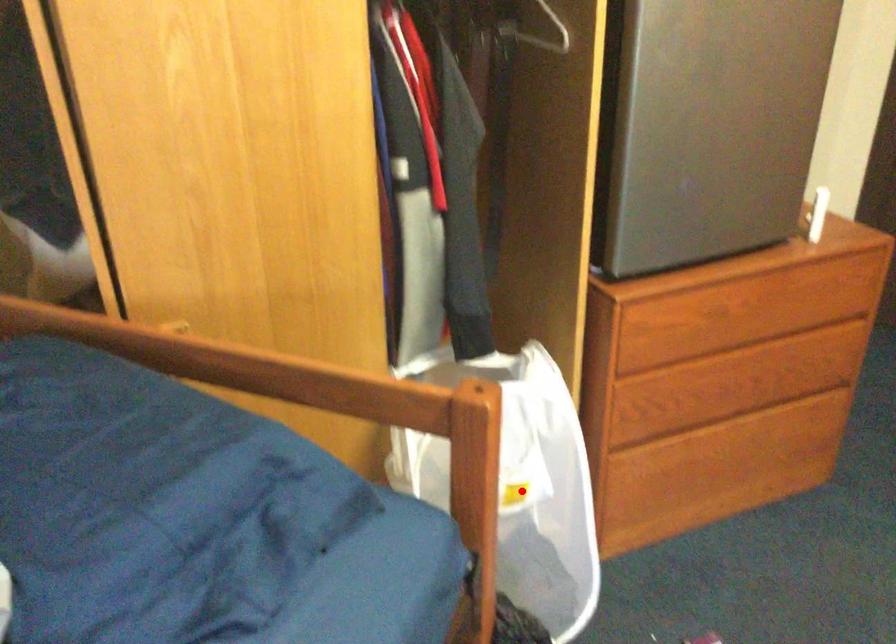
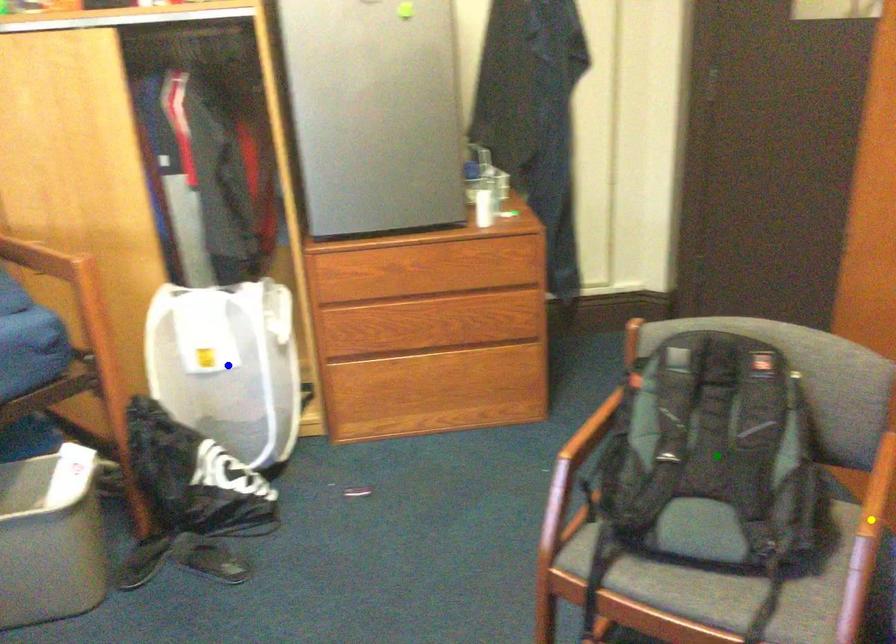
Question: I am providing you with two images of the same scene from different viewpoints. A red point is marked on the first image. You are given multiple points on the second image. Which point in image 2 is actually the same real-world point as the red point in image 1?

Choices:
 (A) green point
 (B) blue point
 (C) yellow point

Answer: (B)